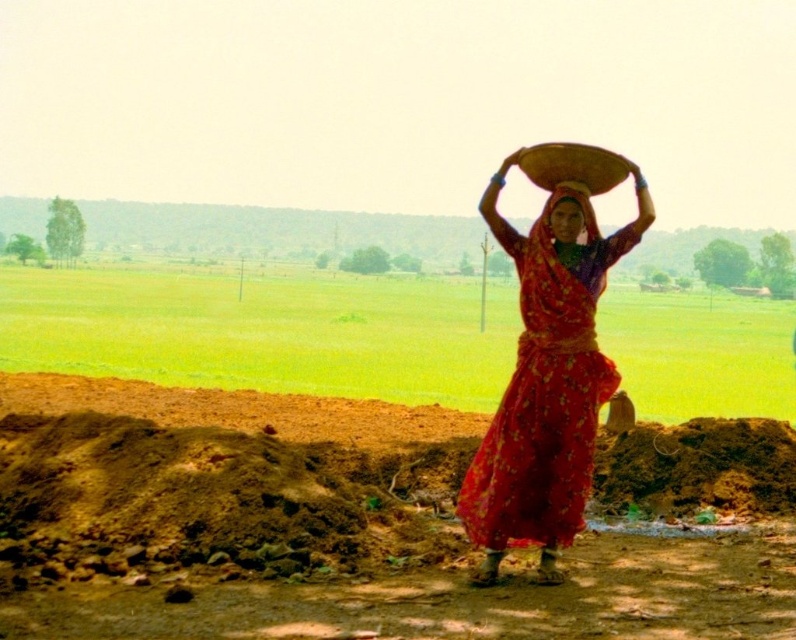
Question: Which of these objects is positioned closest to the green grass at center?

Choices:
 (A) brown soil at center
 (B) matte red fabric at center
 (C) matte red fabric head at center

Answer: (A)

Question: Can you confirm if brown soil at center is bigger than matte red fabric head at center?

Choices:
 (A) no
 (B) yes

Answer: (B)

Question: Which object is the farthest from the brown soil at center?

Choices:
 (A) matte red fabric head at center
 (B) green grass at center
 (C) matte red fabric at center

Answer: (B)

Question: Which of the following is the closest to the observer?

Choices:
 (A) brown soil at center
 (B) matte red fabric at center
 (C) matte red fabric head at center

Answer: (A)

Question: Is brown soil at center above matte red fabric at center?

Choices:
 (A) no
 (B) yes

Answer: (A)

Question: Where is brown soil at center located in relation to matte red fabric head at center in the image?

Choices:
 (A) right
 (B) left

Answer: (B)